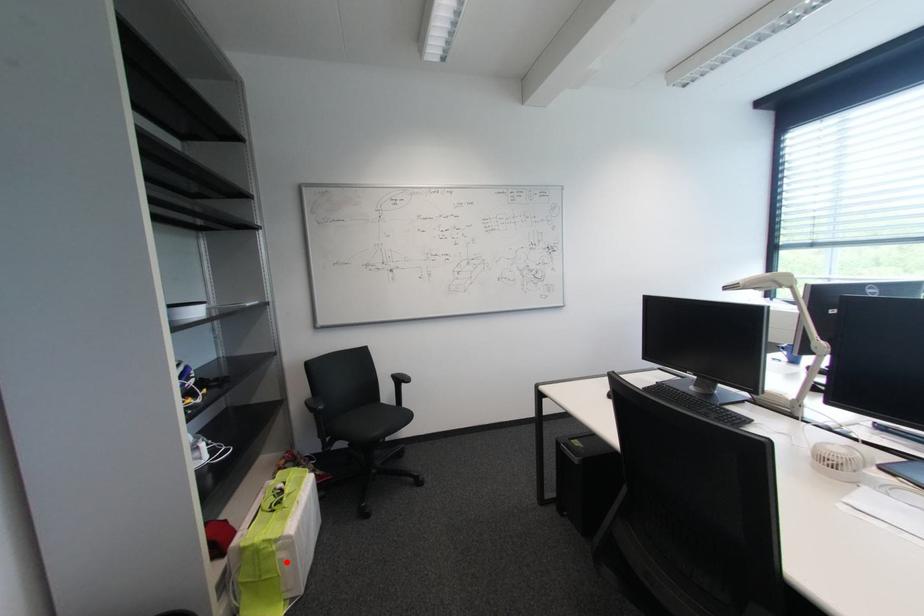
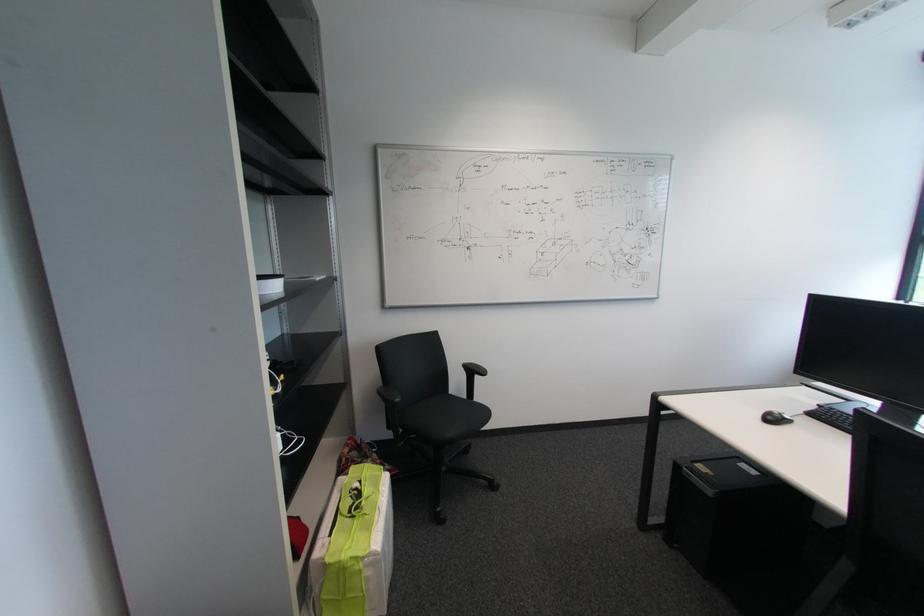
Question: I am providing you with two images of the same scene from different viewpoints. A red point is shown in image1. For the corresponding object point in image2, is it positioned nearer or farther from the camera?

Choices:
 (A) Nearer
 (B) Farther

Answer: (B)